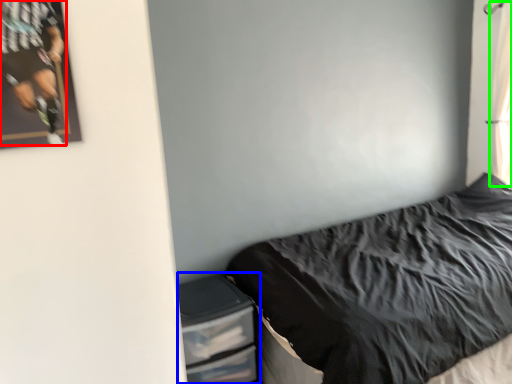
Question: Which is farther away from person (highlighted by a red box)? dresser (highlighted by a blue box) or curtain (highlighted by a green box)?

Choices:
 (A) dresser
 (B) curtain

Answer: (B)